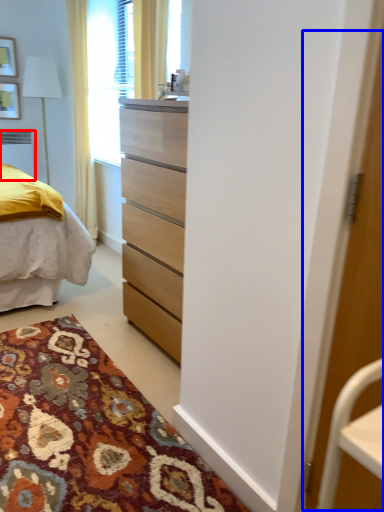
Question: Among these objects, which one is farthest to the camera, radiator (highlighted by a red box) or screen door (highlighted by a blue box)?

Choices:
 (A) radiator
 (B) screen door

Answer: (A)